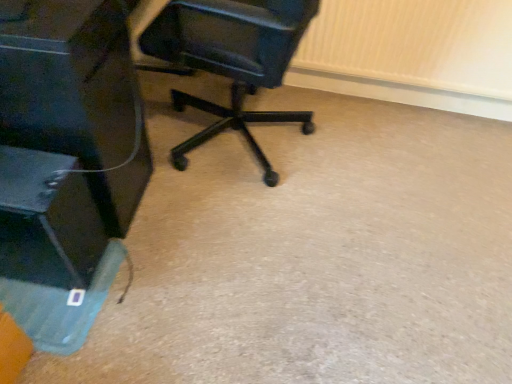
Question: From the image's perspective, relative to matte black monitor at left, is black plastic chair at center above or below?

Choices:
 (A) below
 (B) above

Answer: (B)

Question: From a real-world perspective, is black plastic chair at center physically located above or below matte black monitor at left?

Choices:
 (A) above
 (B) below

Answer: (A)

Question: Is black plastic chair at center taller or shorter than matte black monitor at left?

Choices:
 (A) short
 (B) tall

Answer: (B)

Question: Looking at the image, does matte black monitor at left seem bigger or smaller compared to black plastic chair at center?

Choices:
 (A) small
 (B) big

Answer: (B)

Question: From a real-world perspective, is matte black monitor at left above or below black plastic chair at center?

Choices:
 (A) above
 (B) below

Answer: (B)

Question: Is matte black monitor at left spatially inside black plastic chair at center, or outside of it?

Choices:
 (A) outside
 (B) inside

Answer: (A)

Question: Is matte black monitor at left in front of or behind black plastic chair at center in the image?

Choices:
 (A) front
 (B) behind

Answer: (A)